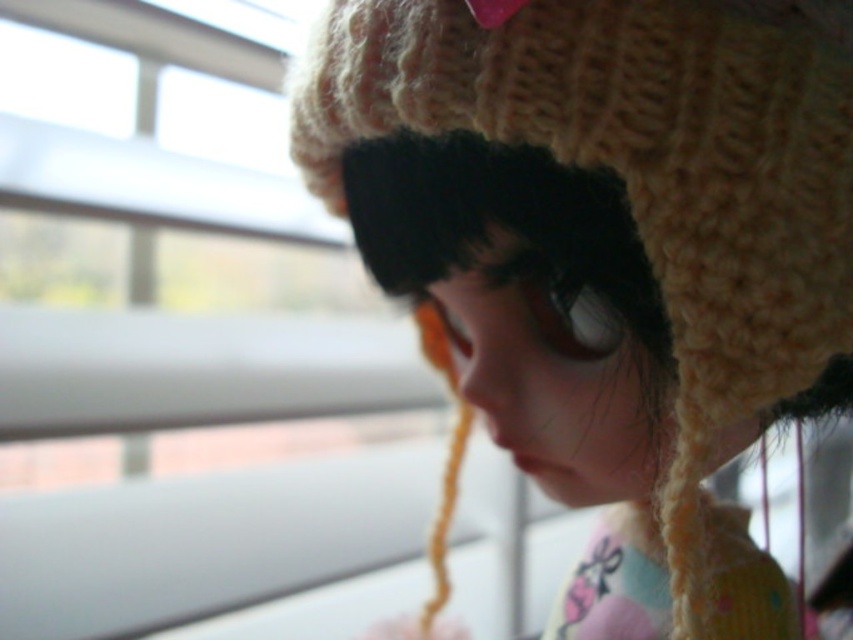
Question: Does transparent glass window at upper left come in front of knitted woolen hat at upper right?

Choices:
 (A) no
 (B) yes

Answer: (A)

Question: Which point is closer to the camera taking this photo?

Choices:
 (A) (680, 241)
 (B) (161, 508)

Answer: (A)

Question: Is transparent glass window at upper left in front of knitted woolen hat at upper right?

Choices:
 (A) no
 (B) yes

Answer: (A)

Question: Can you confirm if transparent glass window at upper left is thinner than knitted woolen hat at upper right?

Choices:
 (A) no
 (B) yes

Answer: (A)